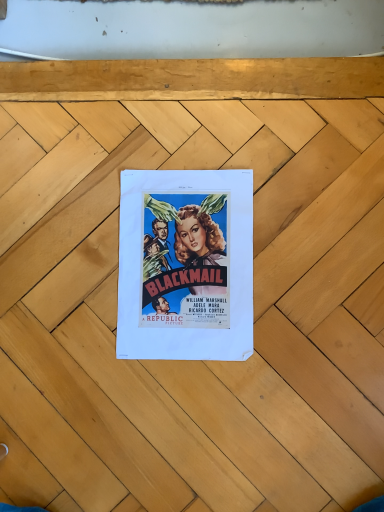
Find the location of a particular element. The height and width of the screenshot is (512, 384). vacant space situated above matte paper poster at center (from a real-world perspective) is located at coordinates (174, 263).